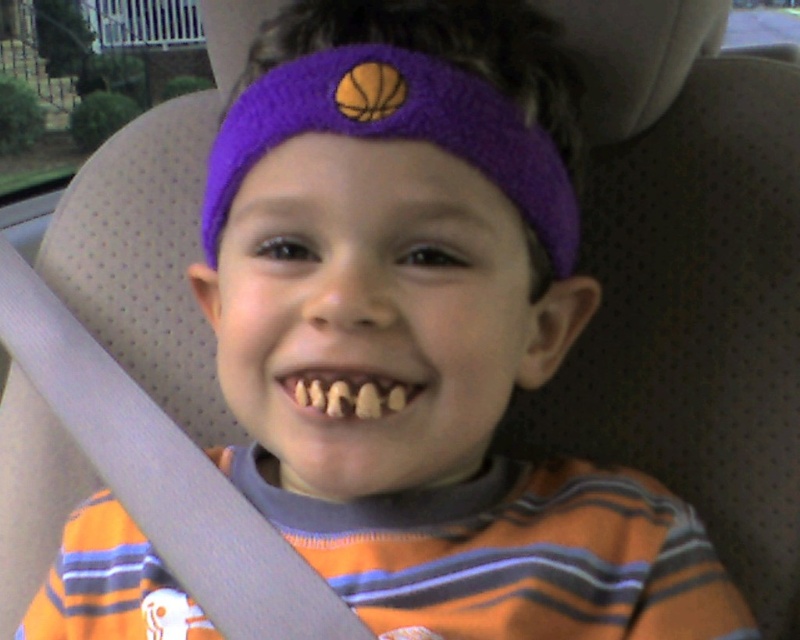
Question: Which object appears farthest from the camera in this image?

Choices:
 (A) purple knitted headband at center
 (B) yellowish matte teeth at center

Answer: (A)

Question: Is purple knitted headband at center below yellowish matte teeth at center?

Choices:
 (A) no
 (B) yes

Answer: (A)

Question: Among these points, which one is nearest to the camera?

Choices:
 (A) (312, 397)
 (B) (216, 211)

Answer: (A)

Question: Can you confirm if purple knitted headband at center is positioned to the right of yellowish matte teeth at center?

Choices:
 (A) yes
 (B) no

Answer: (A)

Question: Can you confirm if purple knitted headband at center is bigger than yellowish matte teeth at center?

Choices:
 (A) yes
 (B) no

Answer: (A)